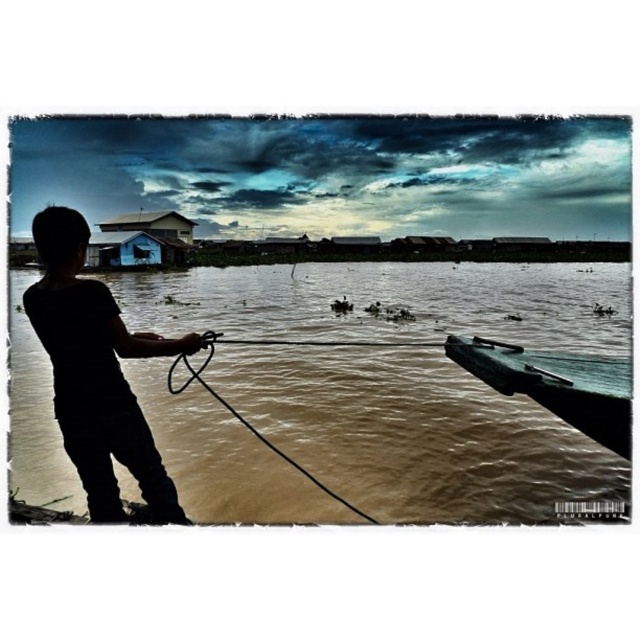
Question: Among these points, which one is nearest to the camera?

Choices:
 (A) (282, 458)
 (B) (154, 470)

Answer: (B)

Question: Can you confirm if brown muddy water at lower left is positioned to the right of black rubber rope at lower center?

Choices:
 (A) no
 (B) yes

Answer: (B)

Question: Does green matte boat at lower right have a greater width compared to black rubber rope at lower center?

Choices:
 (A) no
 (B) yes

Answer: (A)

Question: Estimate the real-world distances between objects in this image. Which object is farther from the black rubber rope at lower center?

Choices:
 (A) green matte boat at lower right
 (B) brown muddy water at lower left
 (C) silhouette boy at left

Answer: (B)

Question: Which of the following is the closest to the observer?

Choices:
 (A) black rubber rope at lower center
 (B) brown muddy water at lower left
 (C) green matte boat at lower right
 (D) silhouette boy at left

Answer: (D)

Question: Is brown muddy water at lower left above black rubber rope at lower center?

Choices:
 (A) yes
 (B) no

Answer: (A)